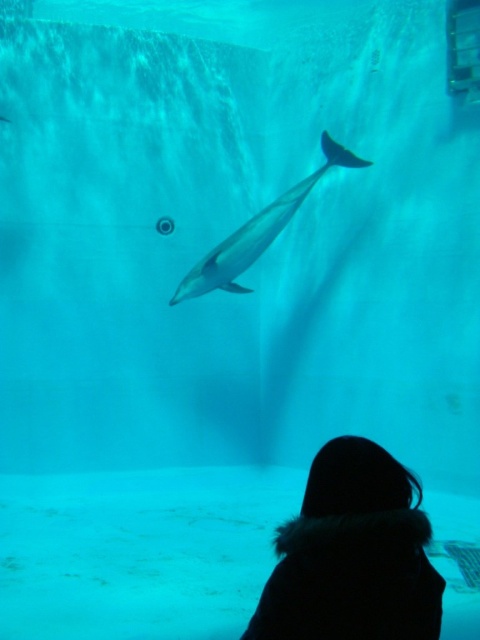
Question: Which point is closer to the camera?

Choices:
 (A) (396, 561)
 (B) (277, 220)

Answer: (A)

Question: Can you confirm if black fur coat at lower center is bigger than smooth gray dolphin at center?

Choices:
 (A) no
 (B) yes

Answer: (A)

Question: Which of the following is the farthest from the observer?

Choices:
 (A) (233, 275)
 (B) (367, 460)

Answer: (A)

Question: Is the position of black fur coat at lower center less distant than that of smooth gray dolphin at center?

Choices:
 (A) yes
 (B) no

Answer: (A)

Question: Is black fur coat at lower center thinner than smooth gray dolphin at center?

Choices:
 (A) no
 (B) yes

Answer: (B)